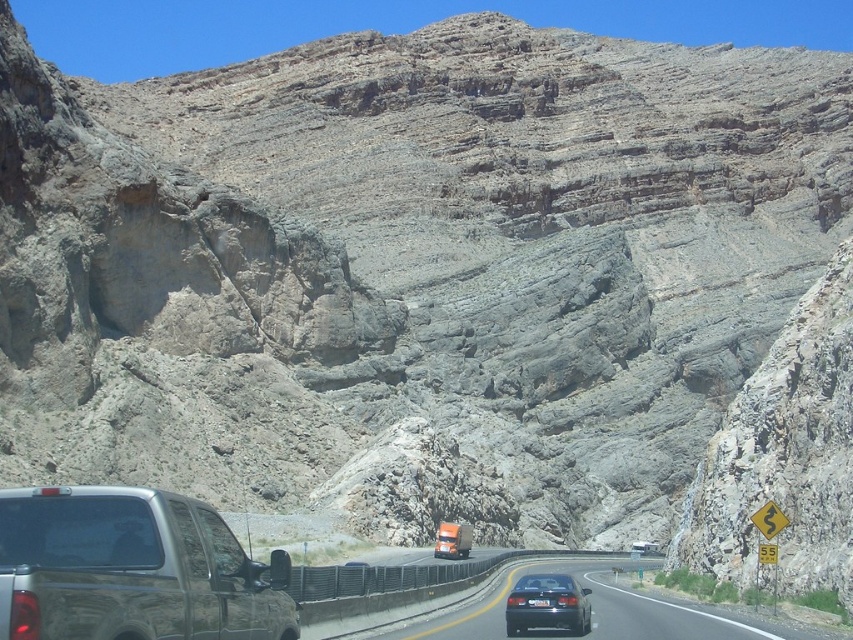
Question: Is metallic gray truck at left wider than black asphalt road at center?

Choices:
 (A) yes
 (B) no

Answer: (B)

Question: Is black asphalt road at center below black plastic license plate at center?

Choices:
 (A) yes
 (B) no

Answer: (A)

Question: Among these points, which one is nearest to the camera?

Choices:
 (A) (572, 600)
 (B) (538, 568)
 (C) (24, 516)

Answer: (C)

Question: Can you confirm if metallic gray truck at left is bigger than black asphalt road at center?

Choices:
 (A) no
 (B) yes

Answer: (A)

Question: Estimate the real-world distances between objects in this image. Which object is farther from the shiny black sedan at center?

Choices:
 (A) metallic gray truck at left
 (B) black plastic license plate at center
 (C) black asphalt road at center

Answer: (A)

Question: Which point is closer to the camera taking this photo?

Choices:
 (A) (39, 529)
 (B) (500, 637)

Answer: (A)